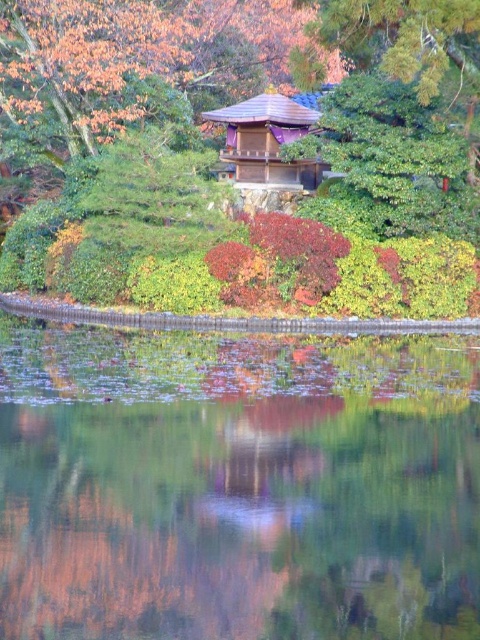
Does green leafy bush at upper center have a greater width compared to wooden shingled hut at center?

Yes.

Based on the photo, can you confirm if green leafy bush at upper center is positioned to the left of wooden shingled hut at center?

Incorrect, green leafy bush at upper center is not on the left side of wooden shingled hut at center.

Who is more forward, (342,212) or (312,182)?

Point (342,212) is more forward.

You are a GUI agent. You are given a task and a screenshot of the screen. Output one action in this format:
    pyautogui.click(x=<x>, y=<y>)
    Task: Click on the green leafy bush at upper center
    The image size is (480, 640).
    Given the screenshot: What is the action you would take?
    (x=369, y=186)

Is transparent glass water at center smaller than green leafy bush at upper center?

Indeed, transparent glass water at center has a smaller size compared to green leafy bush at upper center.

Between point (297, 394) and point (342, 26), which one is positioned in front?

Point (297, 394) is more forward.

Identify the location of transparent glass water at center. The width and height of the screenshot is (480, 640). (237, 484).

Is point (15, 518) farther from viewer compared to point (240, 138)?

No, it is in front of (240, 138).

Who is more forward, [141,564] or [276,157]?

Point [141,564]

What do you see at coordinates (237, 484) in the screenshot? I see `transparent glass water at center` at bounding box center [237, 484].

Where is `transparent glass water at center`? This screenshot has width=480, height=640. transparent glass water at center is located at coordinates (237, 484).